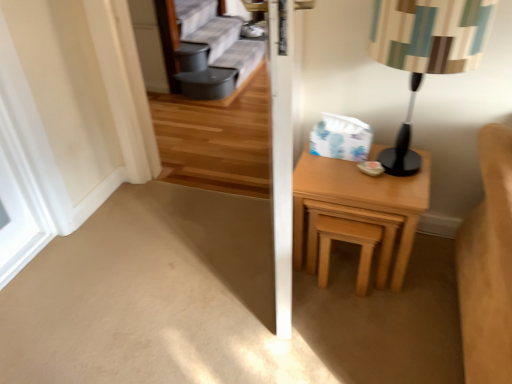
Question: Is light brown wooden stool at right not near white matte window at left?

Choices:
 (A) yes
 (B) no

Answer: (A)

Question: Considering the relative sizes of light brown wooden stool at right and white matte window at left in the image provided, is light brown wooden stool at right bigger than white matte window at left?

Choices:
 (A) yes
 (B) no

Answer: (A)

Question: Is light brown wooden stool at right at the left side of white matte window at left?

Choices:
 (A) yes
 (B) no

Answer: (B)

Question: Can you confirm if light brown wooden stool at right is shorter than white matte window at left?

Choices:
 (A) yes
 (B) no

Answer: (A)

Question: From the image's perspective, is light brown wooden stool at right on white matte window at left?

Choices:
 (A) no
 (B) yes

Answer: (A)

Question: Could you tell me if light brown wooden stool at right is turned towards white matte window at left?

Choices:
 (A) no
 (B) yes

Answer: (A)

Question: Can you confirm if striped fabric lampshade at right is wider than white matte window at left?

Choices:
 (A) no
 (B) yes

Answer: (B)

Question: Is white matte window at left at the back of striped fabric lampshade at right?

Choices:
 (A) no
 (B) yes

Answer: (A)

Question: Is striped fabric lampshade at right further to the viewer compared to white matte window at left?

Choices:
 (A) yes
 (B) no

Answer: (B)

Question: Is striped fabric lampshade at right bigger than white matte window at left?

Choices:
 (A) no
 (B) yes

Answer: (B)

Question: Can you confirm if striped fabric lampshade at right is thinner than white matte window at left?

Choices:
 (A) yes
 (B) no

Answer: (B)

Question: Does striped fabric lampshade at right have a greater height compared to white matte window at left?

Choices:
 (A) yes
 (B) no

Answer: (B)

Question: Is light wood/texture nightstand at right completely or partially outside of light brown wooden stool at right?

Choices:
 (A) no
 (B) yes

Answer: (B)